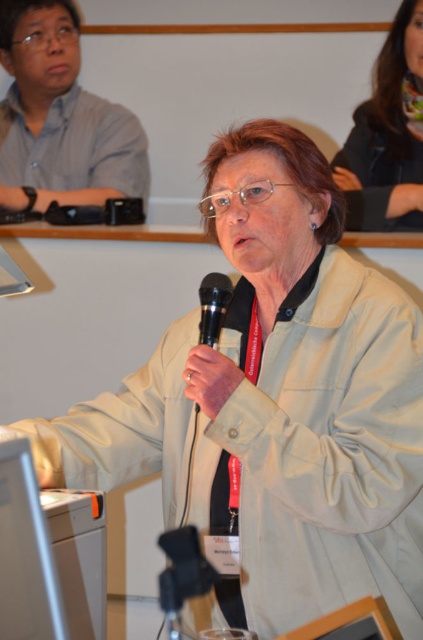
Question: Where is dark brown leather jacket at upper right located in relation to black matte microphone at center in the image?

Choices:
 (A) left
 (B) right

Answer: (B)

Question: Can you confirm if matte gray shirt at upper left is positioned to the right of dark brown leather jacket at upper right?

Choices:
 (A) no
 (B) yes

Answer: (A)

Question: Which point appears farthest from the camera in this image?

Choices:
 (A) (16, 172)
 (B) (417, 10)
 (C) (203, 276)

Answer: (A)

Question: Which object appears closest to the camera in this image?

Choices:
 (A) dark brown leather jacket at upper right
 (B) matte gray shirt at upper left
 (C) black matte microphone at center

Answer: (C)

Question: Which of these objects is positioned farthest from the dark brown leather jacket at upper right?

Choices:
 (A) matte gray shirt at upper left
 (B) black matte microphone at center

Answer: (B)

Question: Does matte gray shirt at upper left appear on the right side of black matte microphone at center?

Choices:
 (A) yes
 (B) no

Answer: (B)